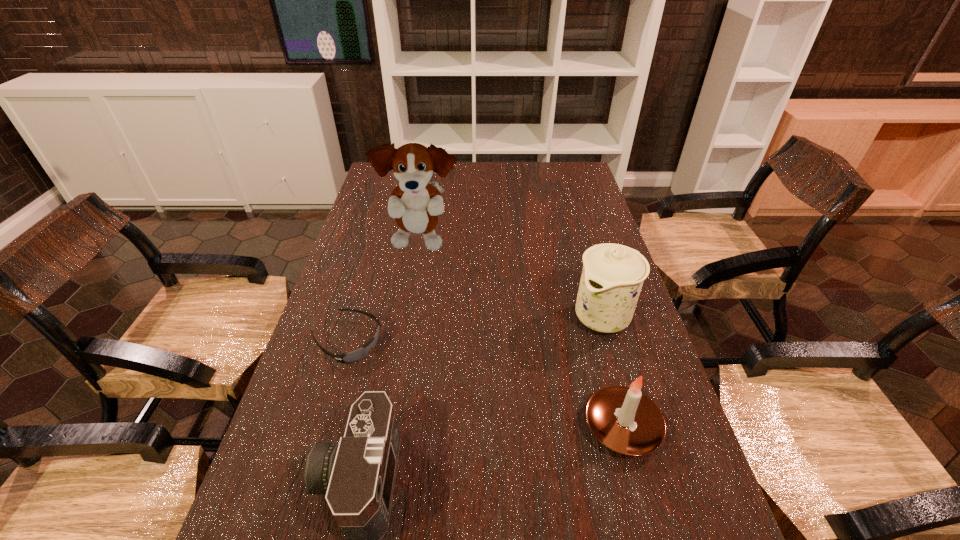
Identify the location of free space on the desktop that is between the fourth tallest object and the candle and is positioned on the face of the farthest object. (489, 454).

Image resolution: width=960 pixels, height=540 pixels. I want to click on free space on the desktop that is between the camera and the candle and is positioned on the lenses of the shortest object, so click(x=529, y=446).

Locate an element on the screen. This screenshot has height=540, width=960. free space on the desktop that is between the camera and the candle and is positioned on the spout of the chinaware is located at coordinates (456, 461).